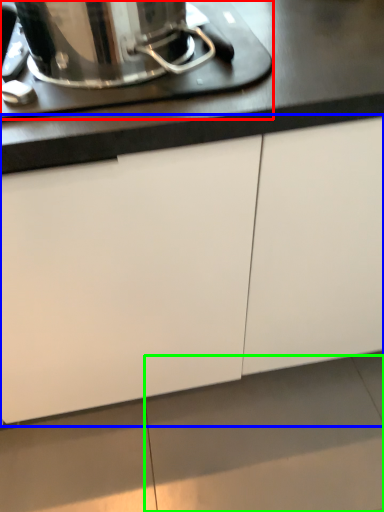
Question: Estimate the real-world distances between objects in this image. Which object is farther from home appliance (highlighted by a red box), cabinetry (highlighted by a blue box) or tile (highlighted by a green box)?

Choices:
 (A) cabinetry
 (B) tile

Answer: (B)